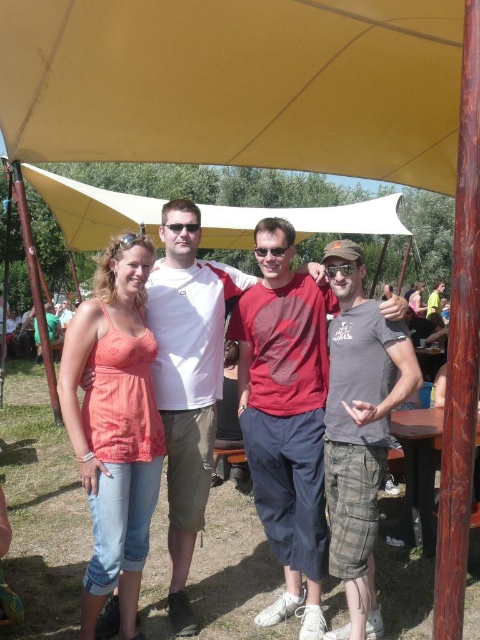
Question: Can you confirm if yellow fabric canopy at upper center is positioned to the left of gray cotton t-shirt at center?

Choices:
 (A) no
 (B) yes

Answer: (B)

Question: Is yellow fabric canopy at upper center wider than gray cotton t-shirt at center?

Choices:
 (A) no
 (B) yes

Answer: (B)

Question: Which is nearer to the pink fabric dress at center?

Choices:
 (A) white cotton shirt at center
 (B) yellow fabric canopy at upper center
 (C) gray cotton t-shirt at center

Answer: (B)

Question: Among these objects, which one is nearest to the camera?

Choices:
 (A) pink fabric dress at center
 (B) yellow fabric canopy at upper center

Answer: (B)

Question: Among these points, which one is farthest from the camera?

Choices:
 (A) (288, 221)
 (B) (436, 291)

Answer: (B)

Question: Does matte red shirt at center appear on the right side of white cotton shirt at center?

Choices:
 (A) yes
 (B) no

Answer: (A)